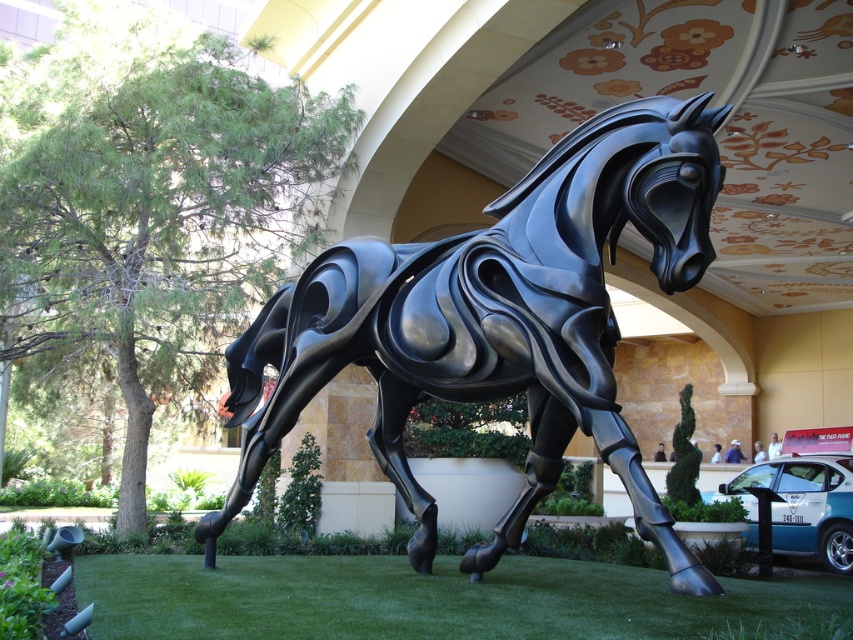
Question: Is glossy black horse at center further to the viewer compared to green grass at lower center?

Choices:
 (A) yes
 (B) no

Answer: (B)

Question: Does glossy black horse at center appear on the right side of green grass at lower center?

Choices:
 (A) no
 (B) yes

Answer: (B)

Question: Which object appears closest to the camera in this image?

Choices:
 (A) green grass at lower center
 (B) glossy black horse at center

Answer: (B)

Question: Is glossy black horse at center closer to camera compared to green grass at lower center?

Choices:
 (A) yes
 (B) no

Answer: (A)